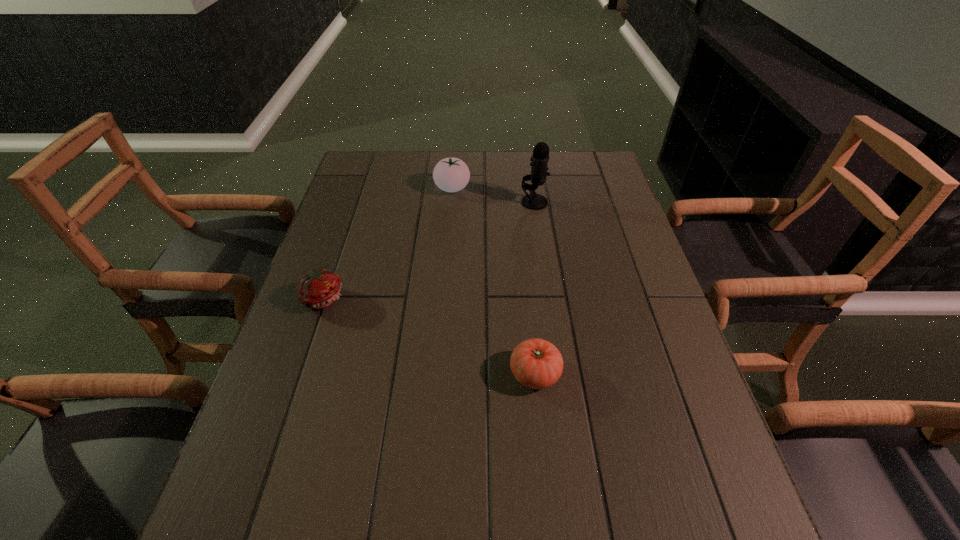
Where is `the tallest object`? This screenshot has height=540, width=960. the tallest object is located at coordinates (540, 158).

Find the location of a particular element. This screenshot has width=960, height=540. the third object from right to left is located at coordinates (450, 174).

This screenshot has height=540, width=960. What are the coordinates of `the third shortest object` in the screenshot? It's located at (450, 174).

Where is `the second nearest object`? the second nearest object is located at coordinates (320, 288).

Identify the location of the leftmost object. (320, 288).

Find the location of a particular element. the nearest object is located at coordinates (536, 363).

I want to click on the nearest tomato, so click(536, 363).

You are a GUI agent. You are given a task and a screenshot of the screen. Output one action in this format:
    pyautogui.click(x=<x>, y=<y>)
    Task: Click on the free space located 0.170m on the right of the tallest object
    The width and height of the screenshot is (960, 540).
    Given the screenshot: What is the action you would take?
    pyautogui.click(x=602, y=202)

Find the location of a particular element. This screenshot has height=540, width=960. blank area located on the left of the tallest tomato is located at coordinates (410, 188).

Locate an element on the screen. This screenshot has width=960, height=540. free point located 0.100m on the right of the leftmost object is located at coordinates (385, 298).